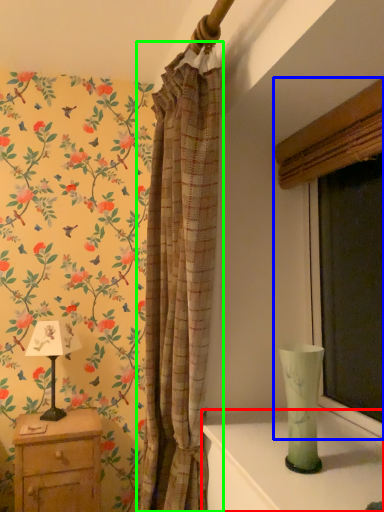
Question: Which object is the farthest from table (highlighted by a red box)? Choose among these: window (highlighted by a blue box) or curtain (highlighted by a green box).

Choices:
 (A) window
 (B) curtain

Answer: (A)